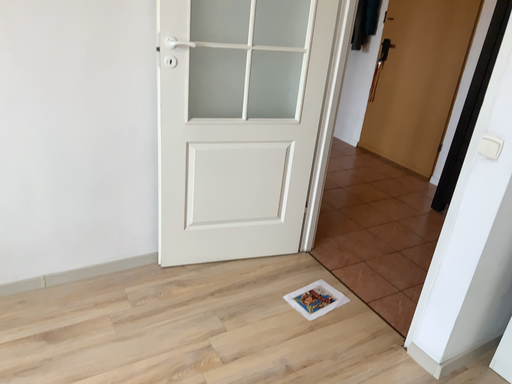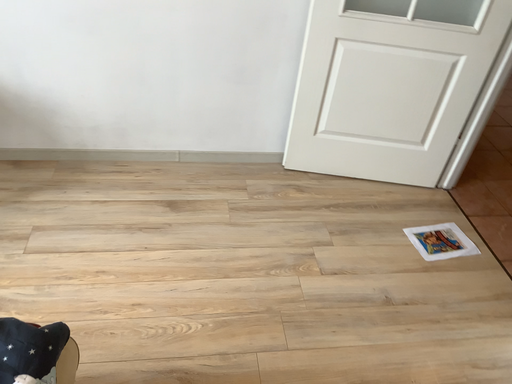
Question: Which way did the camera rotate in the video?

Choices:
 (A) rotated right
 (B) rotated left

Answer: (B)